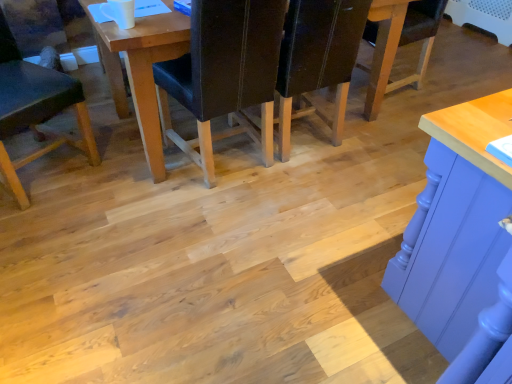
Find the location of a particular element. vacant space underneath matte black chair at lower left, the first chair viewed from the left (from a real-world perspective) is located at coordinates (53, 172).